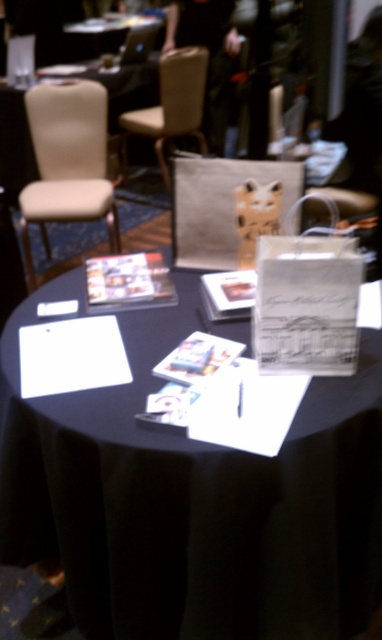
You are standing in front of the table and want to sit down to fill out the form. Is the beige fabric chair at left within comfortable reach to sit on?

The beige fabric chair at left is 7.96 feet from the viewer, which is a reasonable distance for comfortable reach to sit on.

You are organizing an event and need to place a 3.5 meter long banner between the black paper at center and the beige fabric chair at upper center. Will the banner fit between them?

The distance between the black paper at center and the beige fabric chair at upper center is 2.98 meters. Since the banner is 3.5 meters long, it is longer than the available space, so it won